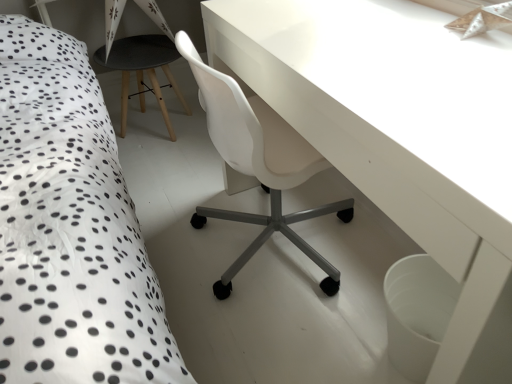
Question: Can you confirm if white glossy table at center is bigger than black matte stool at center?

Choices:
 (A) yes
 (B) no

Answer: (A)

Question: Considering the relative positions of white glossy table at center and black matte stool at center in the image provided, is white glossy table at center to the right of black matte stool at center from the viewer's perspective?

Choices:
 (A) no
 (B) yes

Answer: (B)

Question: Can you confirm if white glossy table at center is wider than black matte stool at center?

Choices:
 (A) no
 (B) yes

Answer: (A)

Question: From a real-world perspective, is white glossy table at center under black matte stool at center?

Choices:
 (A) yes
 (B) no

Answer: (B)

Question: Is the position of white glossy table at center less distant than that of black matte stool at center?

Choices:
 (A) no
 (B) yes

Answer: (B)

Question: Considering the relative positions of white glossy table at center and black matte stool at center in the image provided, is white glossy table at center behind black matte stool at center?

Choices:
 (A) yes
 (B) no

Answer: (B)

Question: Is black matte stool at center located outside white glossy table at center?

Choices:
 (A) no
 (B) yes

Answer: (B)

Question: From the image's perspective, is black matte stool at center below white glossy table at center?

Choices:
 (A) yes
 (B) no

Answer: (B)

Question: Considering the relative positions of black matte stool at center and white glossy table at center in the image provided, is black matte stool at center to the left of white glossy table at center from the viewer's perspective?

Choices:
 (A) no
 (B) yes

Answer: (B)

Question: Can you confirm if black matte stool at center is smaller than white glossy table at center?

Choices:
 (A) yes
 (B) no

Answer: (A)

Question: Is black matte stool at center turned away from white glossy table at center?

Choices:
 (A) yes
 (B) no

Answer: (B)

Question: Is black matte stool at center thinner than white glossy table at center?

Choices:
 (A) no
 (B) yes

Answer: (A)

Question: Is black matte stool at center wider or thinner than white glossy table at center?

Choices:
 (A) wide
 (B) thin

Answer: (A)